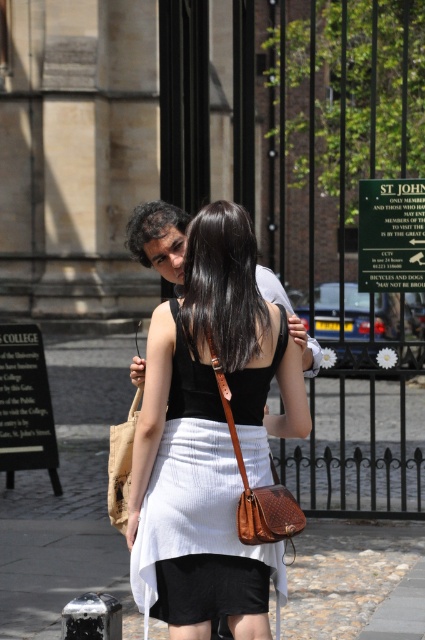
Based on the scene description, where is the white fabric skirt at center located in terms of coordinates?

The white fabric skirt at center is located at the 2D coordinates of point (68, 497).

What is the exact location of the white fabric skirt at center in the image?

The white fabric skirt at center is located at point (68,497).

You are a photographer trying to capture the couple walking on the cobblestone path. You notice the white fabric skirt at center and the brown leather shoulder bag at center. Which object is closer to the camera?

The white fabric skirt at center is closer to the camera because the brown leather shoulder bag at center is behind it.